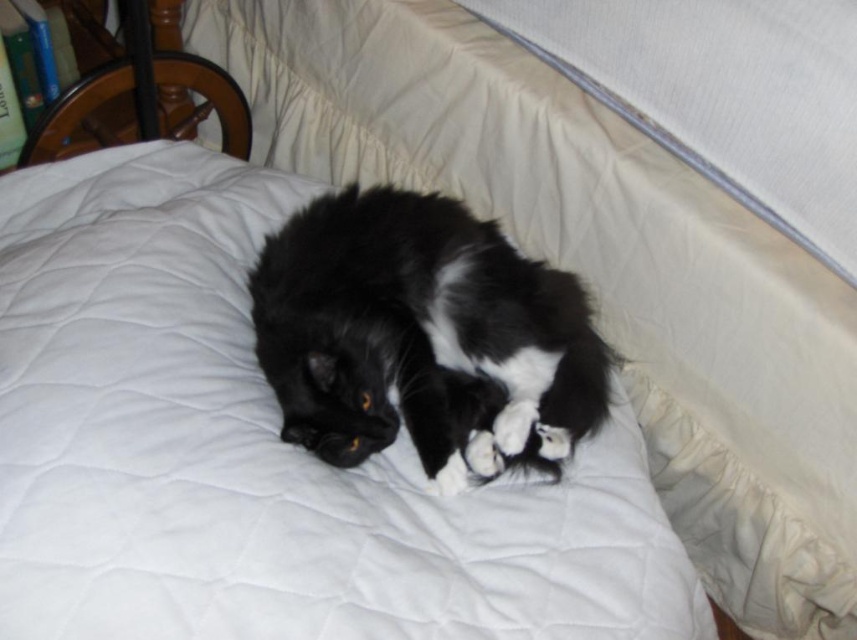
Which is above, white quilt at center or black soft fur cat at center?

black soft fur cat at center is higher up.

Which is more to the right, white quilt at center or black soft fur cat at center?

black soft fur cat at center

What do you see at coordinates (259, 451) in the screenshot? I see `white quilt at center` at bounding box center [259, 451].

Where is `white quilt at center`? This screenshot has height=640, width=857. white quilt at center is located at coordinates 259,451.